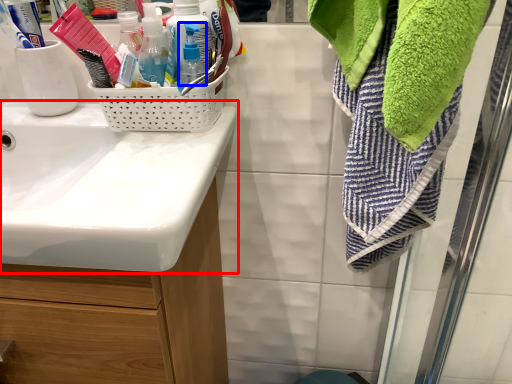
Question: Among these objects, which one is farthest to the camera, sink (highlighted by a red box) or bottle (highlighted by a blue box)?

Choices:
 (A) sink
 (B) bottle

Answer: (B)